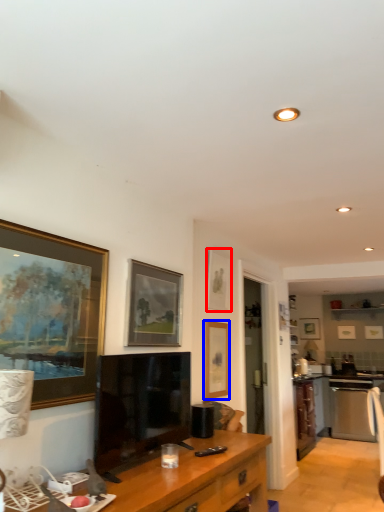
Question: Which object is closer to the camera taking this photo, picture frame (highlighted by a red box) or picture frame (highlighted by a blue box)?

Choices:
 (A) picture frame
 (B) picture frame

Answer: (B)